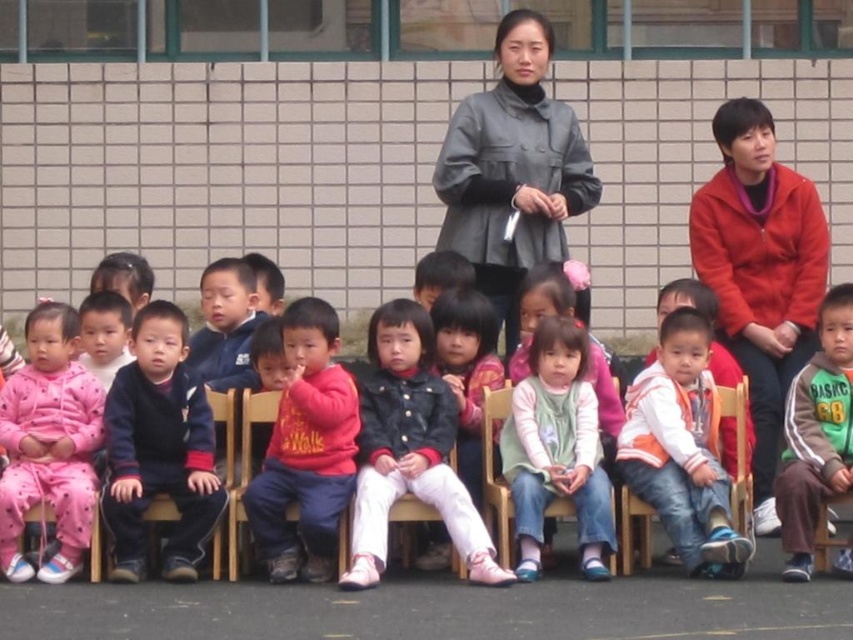
You are a photographer taking a picture of the matte black jacket at center. What are the coordinates where you should focus your camera?

The coordinates where you should focus your camera are at point (409, 449).

You are standing at the front of the scene and want to hand out a gift to both the matte gray coat at center and the light green fabric dress at center. Since you can only move forward or backward, which direction should you move to ensure both are within your 5 meter range?

The matte gray coat at center is 5.83 meters away from the light green fabric dress at center. Since the distance between them is greater than 5 meters, you need to move backward to reduce the distance between yourself and both objects so that both are within your 5 meter range.

You are a photographer taking a picture of the matte black jacket at center and the light green fabric dress at center. Which one is more to the left?

The matte black jacket at center is positioned on the left side of light green fabric dress at center, so the matte black jacket at center is more to the left.